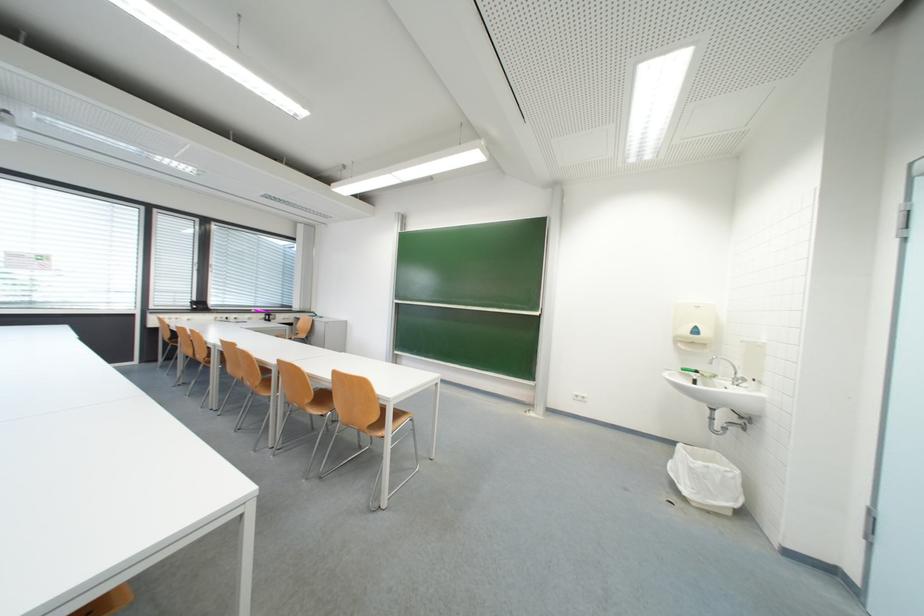
Where would you push the soap dispenser lever? Please return your answer as a coordinate pair (x, y).

(703, 379)